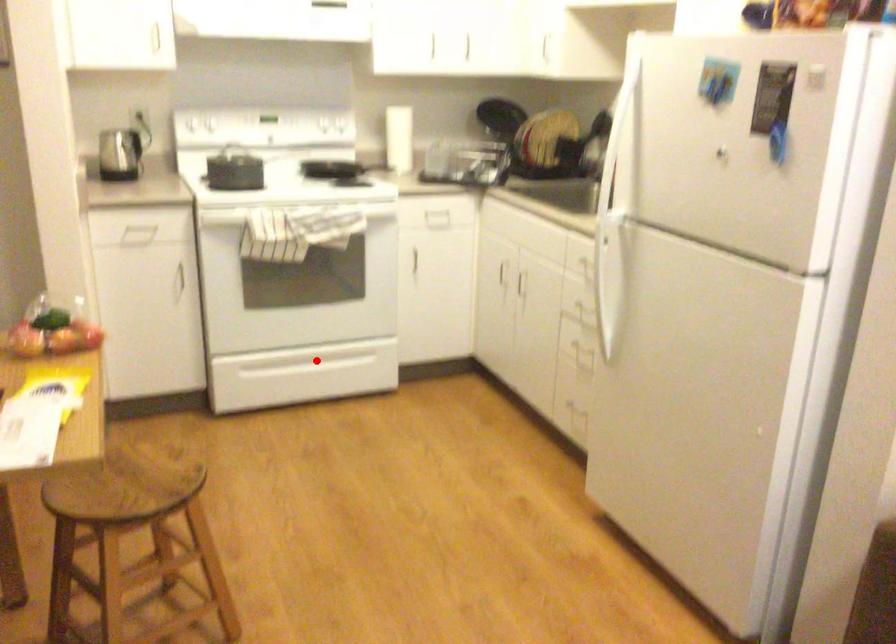
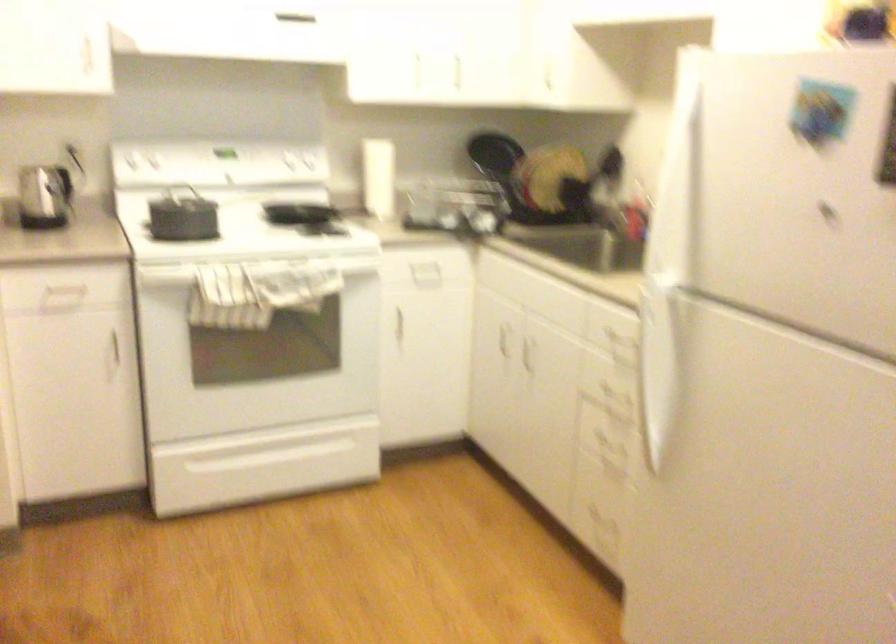
Question: I am providing you with two images of the same scene from different viewpoints. In image1, a red point is highlighted. Considering the same 3D point in image2, which of the following is correct?

Choices:
 (A) It is closer
 (B) It is farther

Answer: (A)